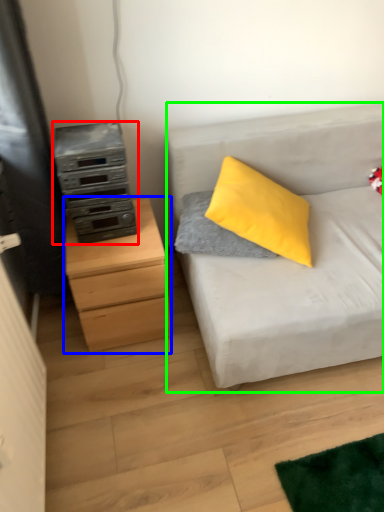
Question: Which object is positioned closest to appliance (highlighted by a red box)? Select from chest of drawers (highlighted by a blue box) and studio couch (highlighted by a green box).

Choices:
 (A) chest of drawers
 (B) studio couch

Answer: (A)